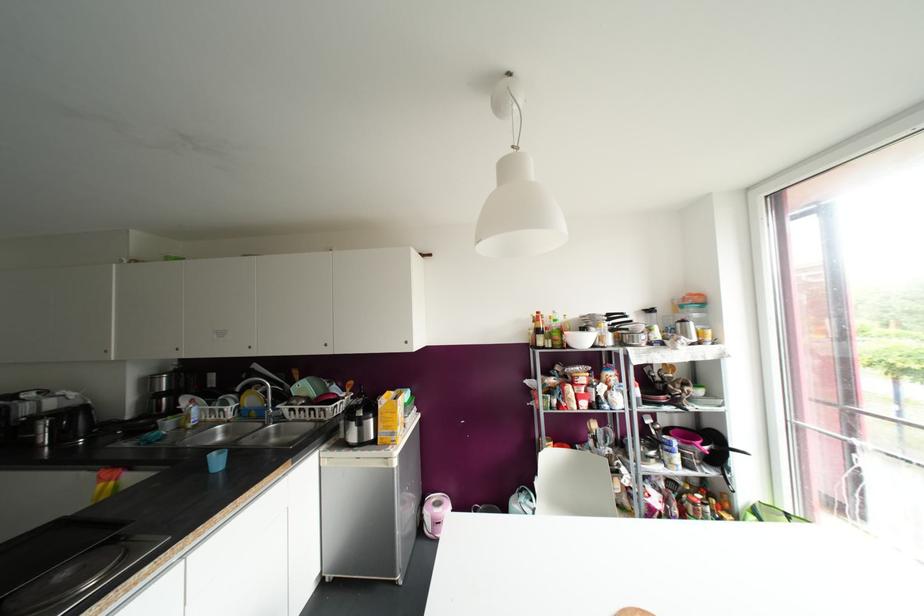
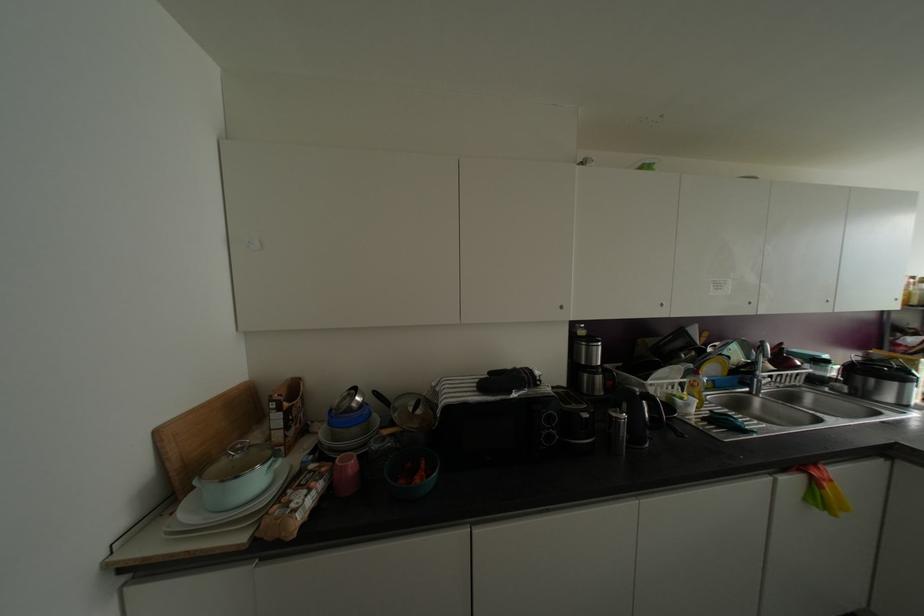
Question: The images are taken continuously from a first-person perspective. In which direction are you moving?

Choices:
 (A) Left
 (B) Right
 (C) Forward
 (D) Backward

Answer: (A)